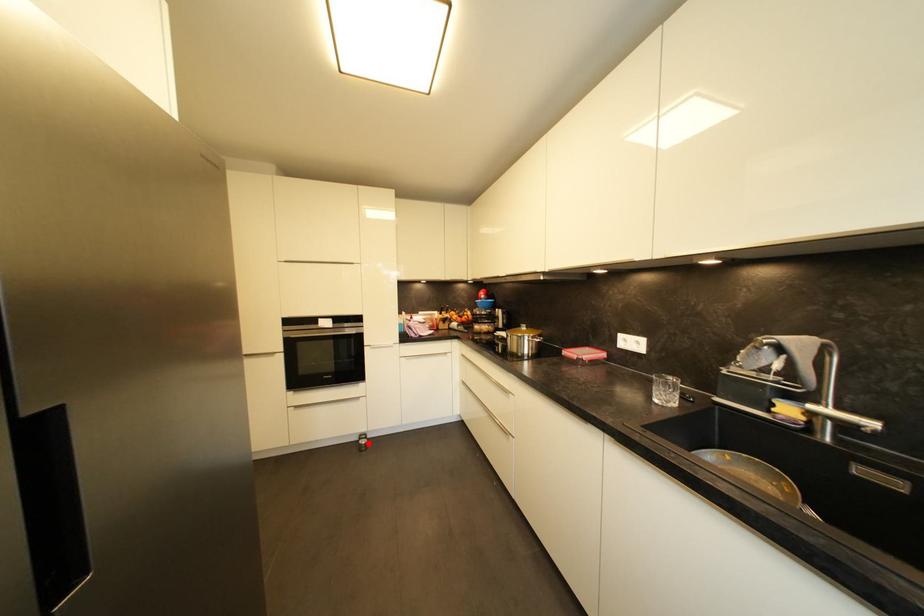
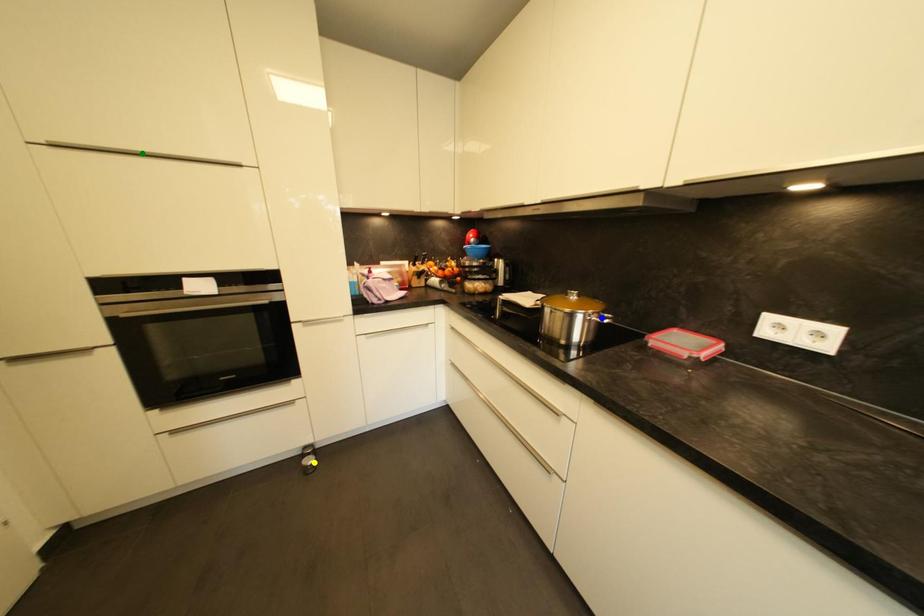
Question: I am providing you with two images of the same scene from different viewpoints. A red point is marked on the first image. You are given multiple points on the second image. In image 2, which mark is for the same physical point as the one in image 1?

Choices:
 (A) green point
 (B) blue point
 (C) yellow point

Answer: (C)